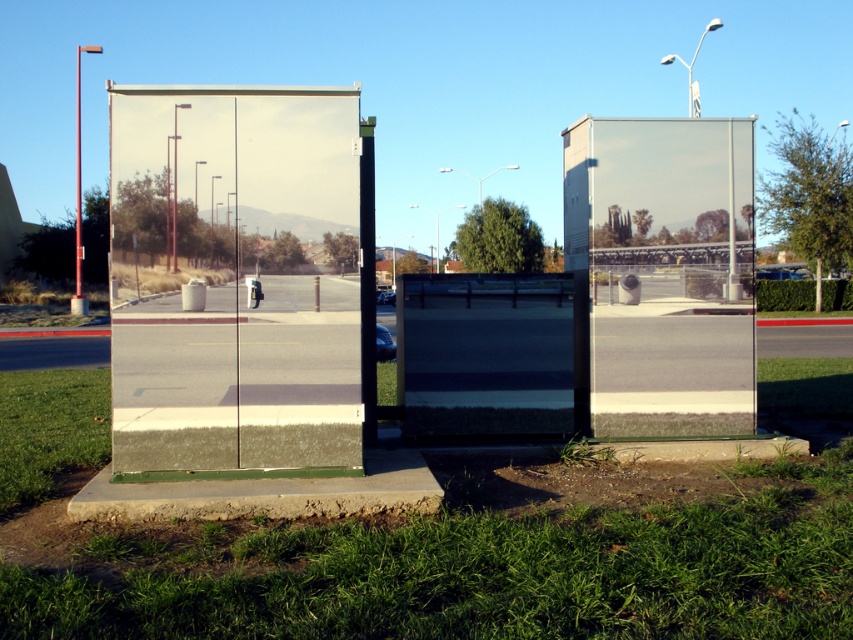
From the picture: Can you confirm if green grass at lower center is smaller than transparent glass phone box at center?

No, green grass at lower center is not smaller than transparent glass phone box at center.

Is green grass at lower center wider than transparent glass phone box at center?

Indeed, green grass at lower center has a greater width compared to transparent glass phone box at center.

Does point (793, 616) come farther from viewer compared to point (485, 428)?

No, it is not.

The image size is (853, 640). Identify the location of green grass at lower center. (427, 547).

Does green grass at lower center have a greater width compared to metallic reflective bus stop at left?

Yes.

This screenshot has height=640, width=853. Identify the location of green grass at lower center. (427, 547).

The image size is (853, 640). Describe the element at coordinates (235, 280) in the screenshot. I see `metallic reflective bus stop at left` at that location.

Between point (187, 429) and point (505, 400), which one is positioned behind?

Point (505, 400)

The width and height of the screenshot is (853, 640). What are the coordinates of `metallic reflective bus stop at left` in the screenshot? It's located at (235, 280).